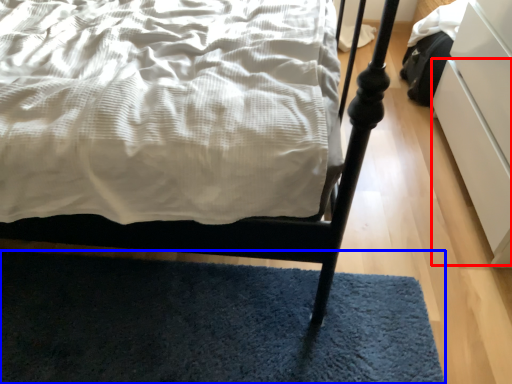
Question: Which point is closer to the camera, drawer (highlighted by a red box) or mat (highlighted by a blue box)?

Choices:
 (A) drawer
 (B) mat

Answer: (A)